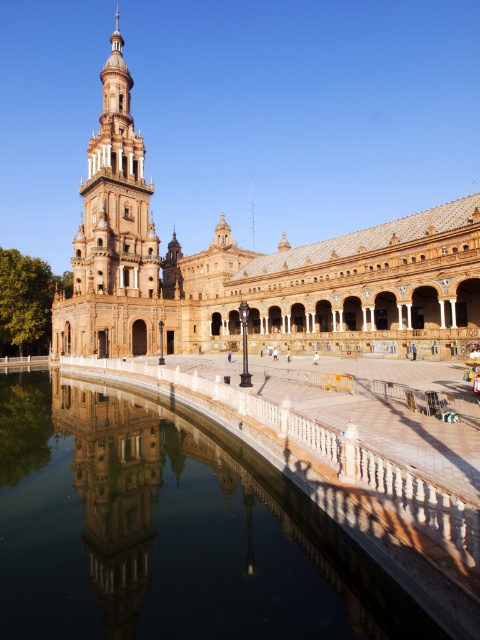
Question: Does golden stone palace at left appear on the left side of white stone tower at left?

Choices:
 (A) no
 (B) yes

Answer: (A)

Question: Estimate the real-world distances between objects in this image. Which object is farther from the golden stone palace at left?

Choices:
 (A) white stone tower at left
 (B) smooth reflective water at center

Answer: (B)

Question: Which of the following is the farthest from the observer?

Choices:
 (A) (212, 339)
 (B) (36, 554)
 (C) (116, 122)

Answer: (C)

Question: Which is farther from the golden stone palace at left?

Choices:
 (A) smooth reflective water at center
 (B) white stone tower at left

Answer: (A)

Question: Is smooth reflective water at center below white stone tower at left?

Choices:
 (A) no
 (B) yes

Answer: (B)

Question: Can you confirm if smooth reflective water at center is bigger than golden stone palace at left?

Choices:
 (A) yes
 (B) no

Answer: (B)